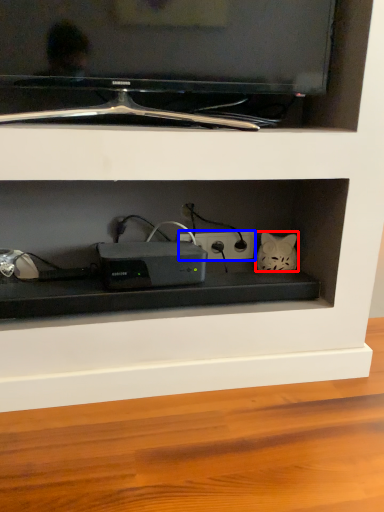
Question: Which object appears farthest to the camera in this image, cat (highlighted by a red box) or electric outlet (highlighted by a blue box)?

Choices:
 (A) cat
 (B) electric outlet

Answer: (B)